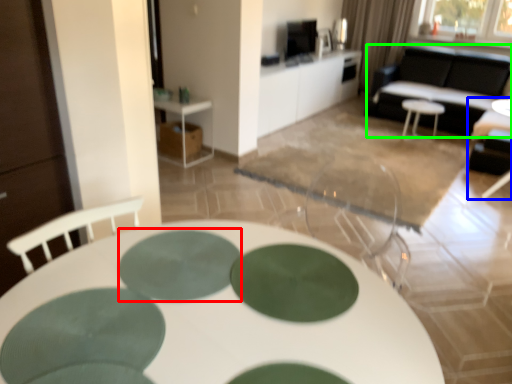
Question: Estimate the real-world distances between objects in this image. Which object is closer to oval (highlighted by a red box), chair (highlighted by a blue box) or couch (highlighted by a green box)?

Choices:
 (A) chair
 (B) couch

Answer: (A)